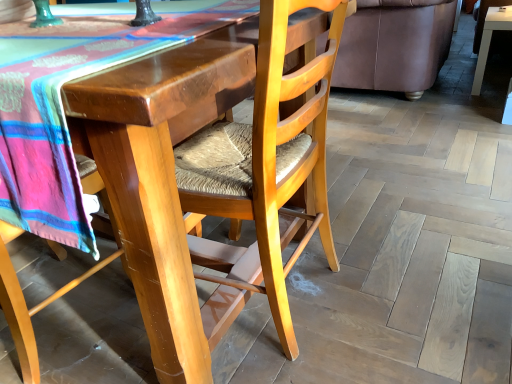
Question: Is wooden woven seat at center, arranged as the 2th chair when viewed from the right, in front of white glossy table at upper right?

Choices:
 (A) yes
 (B) no

Answer: (A)

Question: Considering the relative sizes of wooden woven seat at center, arranged as the 2th chair when viewed from the right, and white glossy table at upper right in the image provided, is wooden woven seat at center, arranged as the 2th chair when viewed from the right, taller than white glossy table at upper right?

Choices:
 (A) yes
 (B) no

Answer: (A)

Question: Is wooden woven seat at center, arranged as the first chair when viewed from the left, positioned behind white glossy table at upper right?

Choices:
 (A) no
 (B) yes

Answer: (A)

Question: Considering the relative sizes of wooden woven seat at center, arranged as the 2th chair when viewed from the right, and white glossy table at upper right in the image provided, is wooden woven seat at center, arranged as the 2th chair when viewed from the right, wider than white glossy table at upper right?

Choices:
 (A) yes
 (B) no

Answer: (A)

Question: Does wooden woven seat at center, arranged as the first chair when viewed from the left, appear on the left side of white glossy table at upper right?

Choices:
 (A) yes
 (B) no

Answer: (A)

Question: Is wooden woven seat at center, arranged as the first chair when viewed from the left, inside or outside of white glossy table at upper right?

Choices:
 (A) inside
 (B) outside

Answer: (B)

Question: From the image's perspective, relative to white glossy table at upper right, is wooden woven seat at center, arranged as the 2th chair when viewed from the right, above or below?

Choices:
 (A) above
 (B) below

Answer: (B)

Question: Is point (249, 291) closer or farther from the camera than point (483, 41)?

Choices:
 (A) closer
 (B) farther

Answer: (A)

Question: Is wooden woven seat at center, arranged as the first chair when viewed from the left, in front of or behind white glossy table at upper right in the image?

Choices:
 (A) behind
 (B) front

Answer: (B)

Question: Visually, is white glossy table at upper right positioned to the left or to the right of wooden woven seat at center, arranged as the 2th chair when viewed from the right?

Choices:
 (A) left
 (B) right

Answer: (B)

Question: Relative to wooden woven seat at center, arranged as the 2th chair when viewed from the right, is white glossy table at upper right in front or behind?

Choices:
 (A) front
 (B) behind

Answer: (B)

Question: Is white glossy table at upper right inside or outside of wooden woven seat at center, arranged as the first chair when viewed from the left?

Choices:
 (A) outside
 (B) inside

Answer: (A)

Question: Is point (490, 11) positioned closer to the camera than point (167, 377)?

Choices:
 (A) closer
 (B) farther

Answer: (B)

Question: Considering the positions of brown leather couch at upper right and wooden woven seat at center, arranged as the 2th chair when viewed from the right, in the image, is brown leather couch at upper right wider or thinner than wooden woven seat at center, arranged as the 2th chair when viewed from the right,?

Choices:
 (A) thin
 (B) wide

Answer: (B)

Question: Considering their positions, is brown leather couch at upper right located in front of or behind wooden woven seat at center, arranged as the 2th chair when viewed from the right?

Choices:
 (A) behind
 (B) front

Answer: (A)